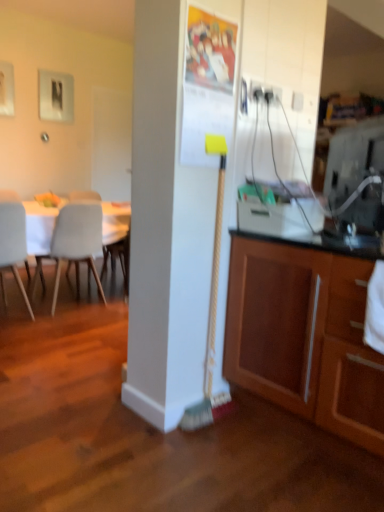
Question: Is yellow-bristled broom at center bigger than wooden cabinet at lower right?

Choices:
 (A) yes
 (B) no

Answer: (B)

Question: Is yellow-bristled broom at center far away from wooden cabinet at lower right?

Choices:
 (A) yes
 (B) no

Answer: (B)

Question: Does yellow-bristled broom at center have a greater width compared to wooden cabinet at lower right?

Choices:
 (A) no
 (B) yes

Answer: (A)

Question: Is yellow-bristled broom at center further to camera compared to wooden cabinet at lower right?

Choices:
 (A) no
 (B) yes

Answer: (B)

Question: Is yellow-bristled broom at center positioned in front of wooden cabinet at lower right?

Choices:
 (A) no
 (B) yes

Answer: (A)

Question: In terms of width, does wooden cabinet at lower right look wider or thinner when compared to white matte chair at left, which is counted as the 2th chair, starting from the right?

Choices:
 (A) thin
 (B) wide

Answer: (B)

Question: Is wooden cabinet at lower right in front of or behind white matte chair at left, which is counted as the 2th chair, starting from the right, in the image?

Choices:
 (A) behind
 (B) front

Answer: (B)

Question: Is wooden cabinet at lower right inside the boundaries of white matte chair at left, which is counted as the 2th chair, starting from the right, or outside?

Choices:
 (A) outside
 (B) inside

Answer: (A)

Question: Is wooden cabinet at lower right bigger or smaller than white matte chair at left, which is counted as the first chair, starting from the left?

Choices:
 (A) big
 (B) small

Answer: (A)

Question: In the image, is white matte chair at left, which is counted as the 2th chair, starting from the right, positioned in front of or behind light gray plastic chair at left, the first chair from the right?

Choices:
 (A) behind
 (B) front

Answer: (B)

Question: In terms of height, does white matte chair at left, which is counted as the first chair, starting from the left, look taller or shorter compared to light gray plastic chair at left, acting as the 2th chair starting from the left?

Choices:
 (A) short
 (B) tall

Answer: (B)

Question: From a real-world perspective, is white matte chair at left, which is counted as the first chair, starting from the left, positioned above or below light gray plastic chair at left, acting as the 2th chair starting from the left?

Choices:
 (A) above
 (B) below

Answer: (B)

Question: Visually, is white matte chair at left, which is counted as the 2th chair, starting from the right, positioned to the left or to the right of light gray plastic chair at left, the first chair from the right?

Choices:
 (A) right
 (B) left

Answer: (B)

Question: From a real-world perspective, relative to white matte chair at left, which is counted as the first chair, starting from the left, is light gray plastic chair at left, the first chair from the right, vertically above or below?

Choices:
 (A) above
 (B) below

Answer: (A)

Question: Considering the positions of point (59, 240) and point (14, 202), is point (59, 240) closer or farther from the camera than point (14, 202)?

Choices:
 (A) farther
 (B) closer

Answer: (A)